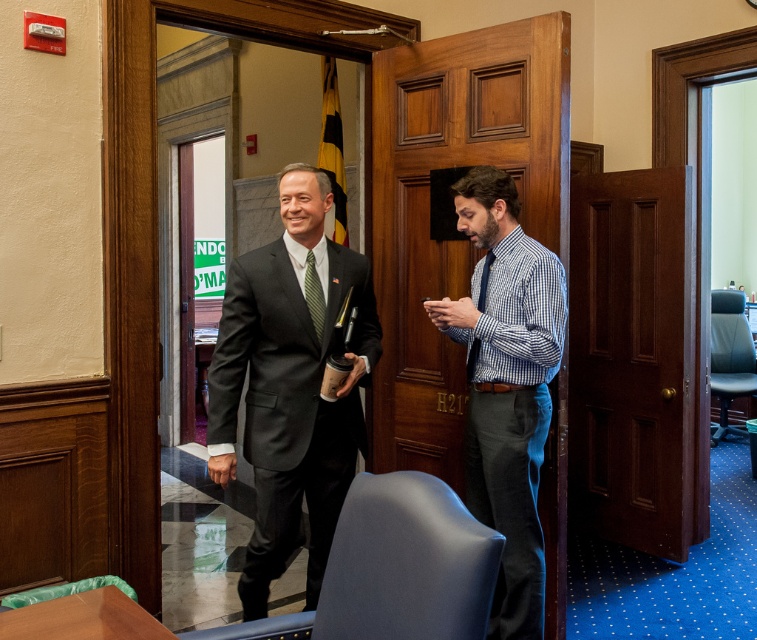
Looking at this image, is blue checkered shirt at center positioned in front of green textured tie at center?

Yes, it is in front of green textured tie at center.

Is blue checkered shirt at center wider than green textured tie at center?

Correct, the width of blue checkered shirt at center exceeds that of green textured tie at center.

Between point (505, 410) and point (310, 288), which one is positioned behind?

Positioned behind is point (310, 288).

The height and width of the screenshot is (640, 757). Find the location of `blue checkered shirt at center`. blue checkered shirt at center is located at coordinates (506, 385).

Between point (269, 500) and point (310, 316), which one is positioned behind?

Point (310, 316)

Locate an element on the screen. matte black suit at center is located at coordinates (290, 387).

Can you confirm if matte black suit at center is wider than blue checkered shirt at center?

Yes.

Based on the photo, does matte black suit at center have a larger size compared to blue checkered shirt at center?

Yes, matte black suit at center is bigger than blue checkered shirt at center.

Measure the distance between point (226, 456) and camera.

A distance of 2.22 meters exists between point (226, 456) and camera.

Find the location of a particular element. This screenshot has width=757, height=640. matte black suit at center is located at coordinates (290, 387).